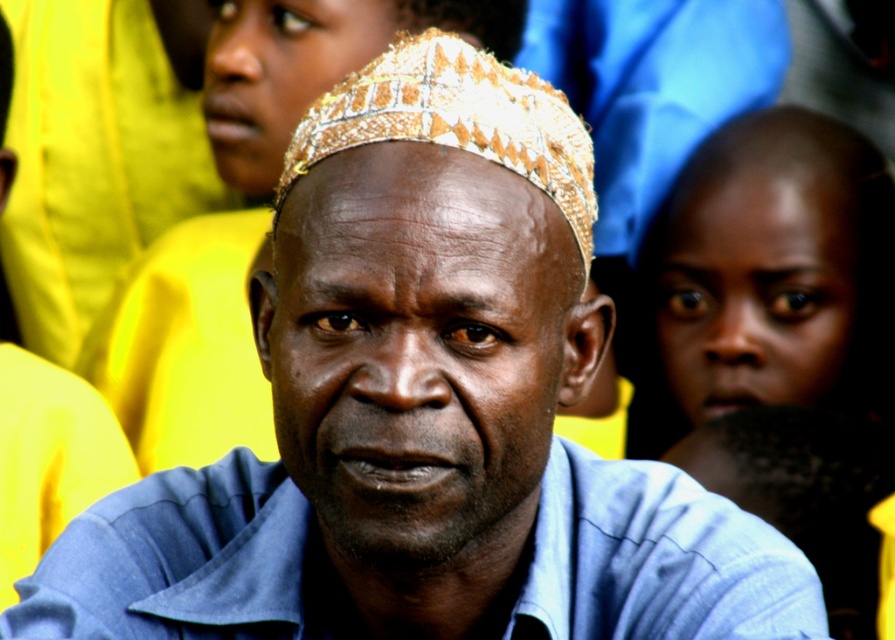
You are a photographer composing a shot of the scene. You want to ensure that both the matte gold headwear at center and the blue fabric head at lower right are clearly visible. Given their positions, which headwear should you focus on first to ensure both are in focus?

The matte gold headwear at center is in front of the blue fabric head at lower right. To ensure both are in focus, focus on the matte gold headwear at center first since it is closer to the camera, allowing the blue fabric head at lower right to remain in focus as well due to depth of field.

You are standing in front of the man in the light blue collared shirt and want to walk towards the point that is closer to you. Which point should you head towards, point (x=437, y=134) or point (x=814, y=500)?

You should head towards point (x=437, y=134) because it is in front of point (x=814, y=500), meaning it is closer to your current position.

You are a photographer trying to capture a group photo. You notice the matte gold headwear at center and the smooth skin head at right. Which of these two objects is positioned to the right side of the other?

The matte gold headwear at center is to the left of smooth skin head at right, so the smooth skin head at right is positioned to the right side of the matte gold headwear at center.